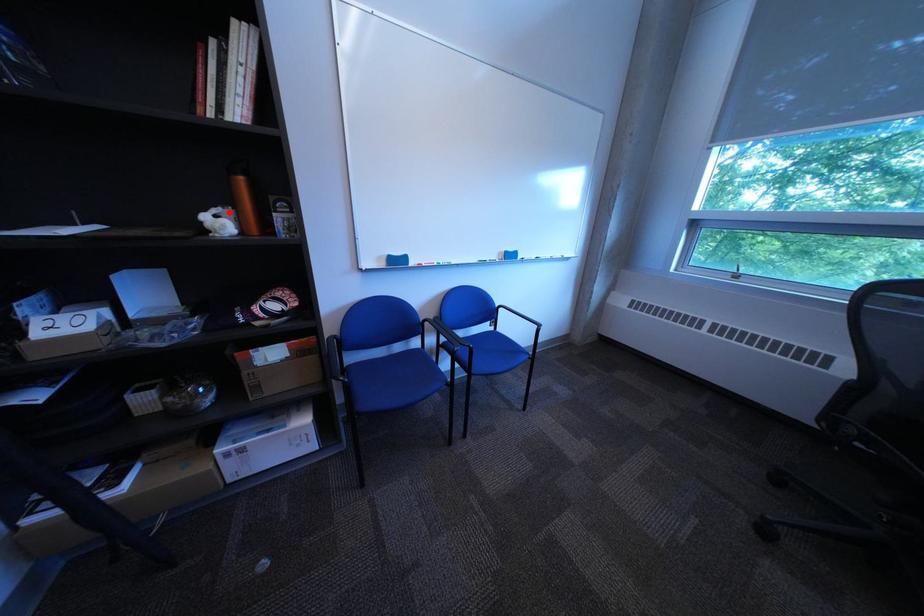
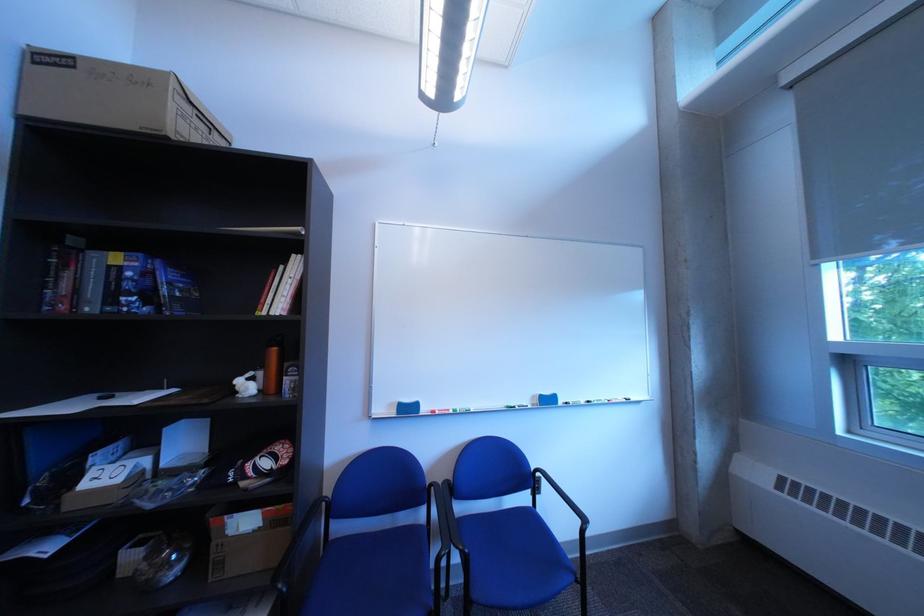
In the second image, find the point that corresponds to the highlighted location in the first image.

(264, 376)